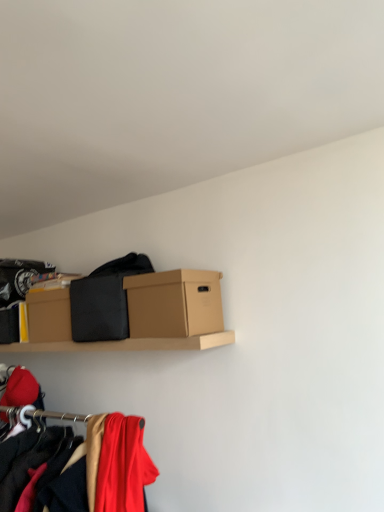
Describe the element at coordinates (174, 304) in the screenshot. Image resolution: width=384 pixels, height=512 pixels. I see `brown cardboard box at center` at that location.

In order to face matte red fabric at lower left, the 2th clothing viewed from the top, should I rotate leftwards or rightwards?

You should look left and rotate roughly 8.528 degrees.

At what (x,y) coordinates should I click in order to perform the action: click on brown cardboard box at center. Please return your answer as a coordinate pair (x, y). The image size is (384, 512). Looking at the image, I should click on (174, 304).

From a real-world perspective, is brown cardboard box at center physically located above or below matte red fabric at lower left, marked as the first clothing in a bottom-to-top arrangement?

brown cardboard box at center is situated higher than matte red fabric at lower left, marked as the first clothing in a bottom-to-top arrangement, in the real world.

Between brown cardboard box at center and matte red fabric at lower left, marked as the 2th clothing in a back-to-front arrangement, which one has less height?

Standing shorter between the two is brown cardboard box at center.

Is brown cardboard box at center not within matte red fabric at lower left, the 2th clothing viewed from the top?

Yes, brown cardboard box at center is outside of matte red fabric at lower left, the 2th clothing viewed from the top.

Is point (136, 282) closer to viewer compared to point (140, 493)?

No, it is behind (140, 493).

Choose the correct answer: Is matte red fabric at lower left, marked as the 2th clothing in a back-to-front arrangement, inside brown cardboard box at center or outside it?

matte red fabric at lower left, marked as the 2th clothing in a back-to-front arrangement, is spatially situated outside brown cardboard box at center.

Is matte red fabric at lower left, which ranks as the 1th clothing in front-to-back order, in contact with brown cardboard box at center?

No, matte red fabric at lower left, which ranks as the 1th clothing in front-to-back order, is not touching brown cardboard box at center.

Based on their positions, is matte red fabric at lower left, the 2th clothing viewed from the top, located to the left or right of brown cardboard box at center?

In the image, matte red fabric at lower left, the 2th clothing viewed from the top, appears on the left side of brown cardboard box at center.

Does matte red fabric at lower left, marked as the first clothing in a bottom-to-top arrangement, lie in front of brown cardboard box at center?

Yes.

Which of these two, matte red fabric at lower left, which ranks as the 1th clothing in front-to-back order, or black matte fabric at center, the 2th clothing from the front, is thinner?

With smaller width is matte red fabric at lower left, which ranks as the 1th clothing in front-to-back order.

Which is more distant, [140,469] or [87,310]?

The point [87,310] is farther.

From the image's perspective, which is above, matte red fabric at lower left, which ranks as the 1th clothing in front-to-back order, or black matte fabric at center, the 1th clothing when ordered from back to front?

black matte fabric at center, the 1th clothing when ordered from back to front, appears higher in the image.

Is black matte fabric at center, the second clothing in the bottom-to-top sequence, inside the boundaries of brown cardboard box at center, or outside?

black matte fabric at center, the second clothing in the bottom-to-top sequence, is spatially situated outside brown cardboard box at center.

What's the angular difference between black matte fabric at center, the second clothing in the bottom-to-top sequence, and brown cardboard box at center's facing directions?

They differ by 5.01 degrees in their facing directions.

From a real-world perspective, between black matte fabric at center, the 2th clothing from the front, and brown cardboard box at center, who is vertically lower?

brown cardboard box at center, from a real-world perspective.

Considering the sizes of objects black matte fabric at center, the second clothing in the bottom-to-top sequence, and brown cardboard box at center in the image provided, who is taller, black matte fabric at center, the second clothing in the bottom-to-top sequence, or brown cardboard box at center?

With more height is black matte fabric at center, the second clothing in the bottom-to-top sequence.

How much distance is there between black matte fabric at center, the 2th clothing from the front, and matte red fabric at lower left, marked as the 2th clothing in a back-to-front arrangement?

black matte fabric at center, the 2th clothing from the front, and matte red fabric at lower left, marked as the 2th clothing in a back-to-front arrangement, are 20.10 inches apart.

Based on the photo, which point is more distant from viewer, (114, 313) or (100, 506)?

The point (114, 313) is behind.

Which object is further away from the camera taking this photo, black matte fabric at center, the second clothing in the bottom-to-top sequence, or matte red fabric at lower left, the 2th clothing viewed from the top?

black matte fabric at center, the second clothing in the bottom-to-top sequence.

From a real-world perspective, who is located higher, black matte fabric at center, the 2th clothing from the front, or matte red fabric at lower left, the 2th clothing viewed from the top?

In real-world perspective, black matte fabric at center, the 2th clothing from the front, is above.

Is brown cardboard box at center surrounding black matte fabric at center, the second clothing in the bottom-to-top sequence?

Actually, black matte fabric at center, the second clothing in the bottom-to-top sequence, is outside brown cardboard box at center.

Is brown cardboard box at center to the left or to the right of black matte fabric at center, the second clothing in the bottom-to-top sequence, in the image?

From the image, it's evident that brown cardboard box at center is to the right of black matte fabric at center, the second clothing in the bottom-to-top sequence.

In order to click on box that is above the matte red fabric at lower left, the 2th clothing viewed from the top (from a real-world perspective) in this screenshot , I will do `click(174, 304)`.

You are a GUI agent. You are given a task and a screenshot of the screen. Output one action in this format:
    pyautogui.click(x=<x>, y=<y>)
    Task: Click on the box lying above the matte red fabric at lower left, the 2th clothing viewed from the top (from the image's perspective)
    The width and height of the screenshot is (384, 512).
    Given the screenshot: What is the action you would take?
    pyautogui.click(x=174, y=304)

Which object lies further to the anchor point brown cardboard box at center, black matte fabric at center, which is the 1th clothing from top to bottom, or matte red fabric at lower left, marked as the first clothing in a bottom-to-top arrangement?

matte red fabric at lower left, marked as the first clothing in a bottom-to-top arrangement, is positioned further to the anchor brown cardboard box at center.

Based on their spatial positions, is black matte fabric at center, the 2th clothing from the front, or brown cardboard box at center closer to matte red fabric at lower left, which ranks as the 1th clothing in front-to-back order?

Based on the image, brown cardboard box at center appears to be nearer to matte red fabric at lower left, which ranks as the 1th clothing in front-to-back order.

Which object lies nearer to the anchor point black matte fabric at center, which is the 1th clothing from top to bottom, matte red fabric at lower left, marked as the first clothing in a bottom-to-top arrangement, or brown cardboard box at center?

brown cardboard box at center.

Estimate the real-world distances between objects in this image. Which object is closer to matte red fabric at lower left, marked as the first clothing in a bottom-to-top arrangement, brown cardboard box at center or black matte fabric at center, the second clothing in the bottom-to-top sequence?

Among the two, brown cardboard box at center is located nearer to matte red fabric at lower left, marked as the first clothing in a bottom-to-top arrangement.

Estimate the real-world distances between objects in this image. Which object is further from black matte fabric at center, the 2th clothing from the front, brown cardboard box at center or matte red fabric at lower left, marked as the 2th clothing in a back-to-front arrangement?

Among the two, matte red fabric at lower left, marked as the 2th clothing in a back-to-front arrangement, is located further to black matte fabric at center, the 2th clothing from the front.

Estimate the real-world distances between objects in this image. Which object is further from brown cardboard box at center, matte red fabric at lower left, marked as the 2th clothing in a back-to-front arrangement, or black matte fabric at center, the second clothing in the bottom-to-top sequence?

The object further to brown cardboard box at center is matte red fabric at lower left, marked as the 2th clothing in a back-to-front arrangement.

Locate an element on the screen. clothing between brown cardboard box at center and matte red fabric at lower left, marked as the 2th clothing in a back-to-front arrangement, vertically is located at coordinates (104, 300).